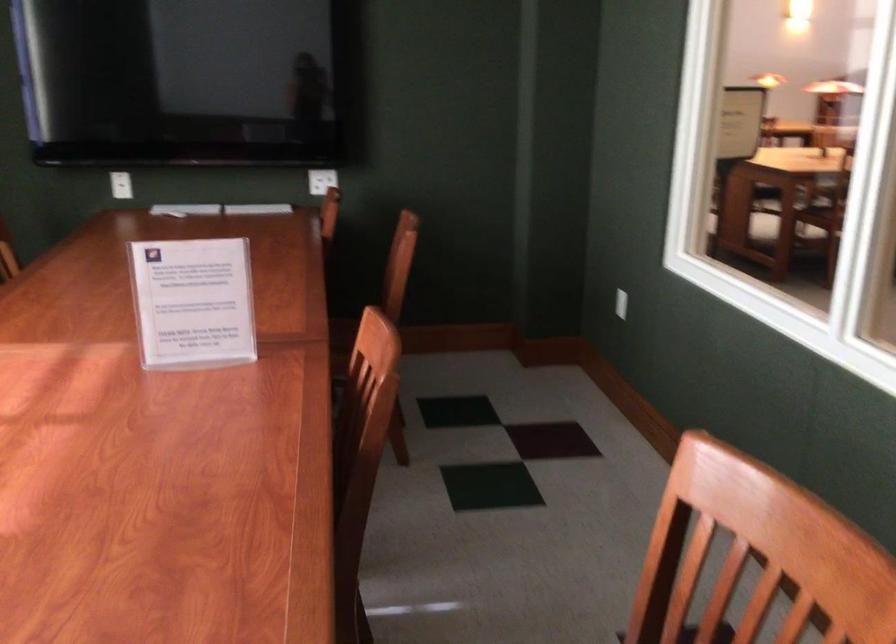
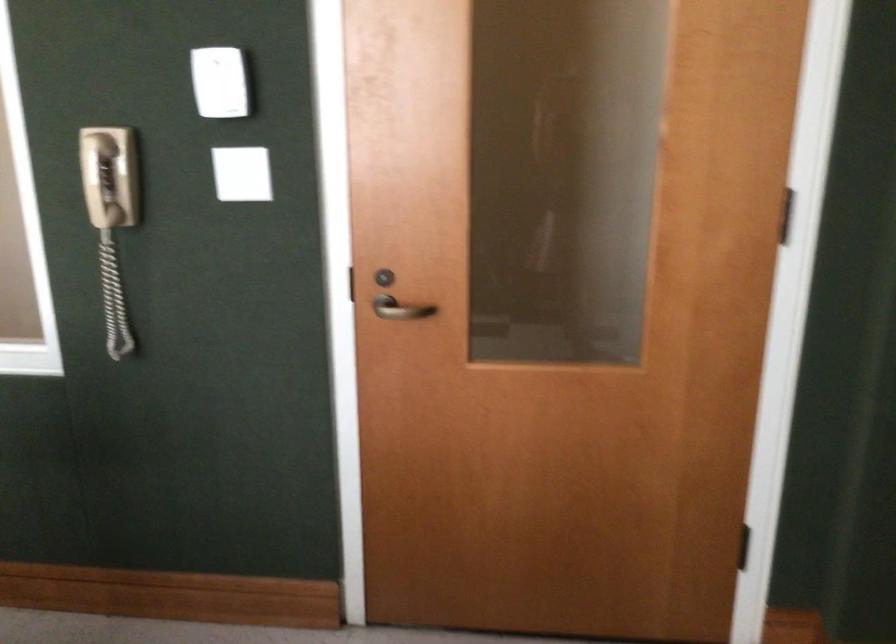
Question: Based on the continuous images, in which direction is the camera rotating? Reply with the corresponding letter.

Choices:
 (A) Left
 (B) Right
 (C) Up
 (D) Down

Answer: (B)